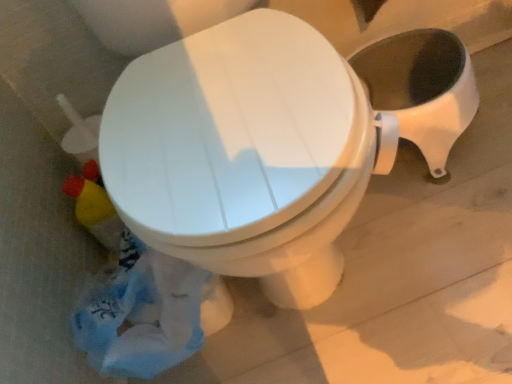
Question: From the image's perspective, is blue plastic bag at lower left located above or below white glossy toilet at center?

Choices:
 (A) below
 (B) above

Answer: (A)

Question: Is point (91, 347) closer or farther from the camera than point (232, 94)?

Choices:
 (A) farther
 (B) closer

Answer: (A)

Question: Is blue plastic bag at lower left inside or outside of white glossy toilet at center?

Choices:
 (A) inside
 (B) outside

Answer: (B)

Question: Is white glossy toilet at center to the left or to the right of blue plastic bag at lower left in the image?

Choices:
 (A) right
 (B) left

Answer: (A)

Question: In terms of size, does white glossy toilet at center appear bigger or smaller than blue plastic bag at lower left?

Choices:
 (A) big
 (B) small

Answer: (A)

Question: Considering the positions of white glossy toilet at center and blue plastic bag at lower left in the image, is white glossy toilet at center wider or thinner than blue plastic bag at lower left?

Choices:
 (A) thin
 (B) wide

Answer: (B)

Question: In terms of height, does white glossy toilet at center look taller or shorter compared to blue plastic bag at lower left?

Choices:
 (A) short
 (B) tall

Answer: (A)